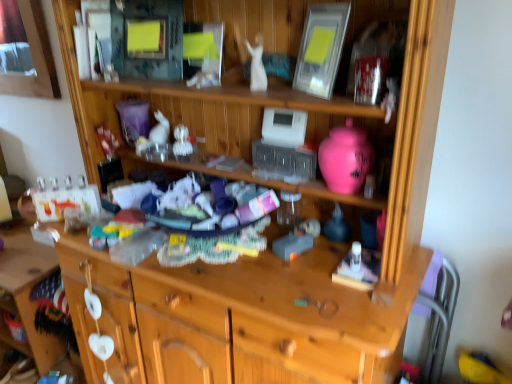
Question: Considering the relative positions of white glossy statue at center, acting as the second toy starting from the right, and pink glossy vase at upper right, the 1th toy in the front-to-back sequence, in the image provided, is white glossy statue at center, acting as the second toy starting from the right, to the right of pink glossy vase at upper right, the 1th toy in the front-to-back sequence, from the viewer's perspective?

Choices:
 (A) yes
 (B) no

Answer: (B)

Question: Considering the relative sizes of white glossy statue at center, the 3th toy positioned from the back, and pink glossy vase at upper right, the 1th toy when ordered from right to left, in the image provided, is white glossy statue at center, the 3th toy positioned from the back, wider than pink glossy vase at upper right, the 1th toy when ordered from right to left,?

Choices:
 (A) yes
 (B) no

Answer: (B)

Question: Is white glossy statue at center, the 2th toy from the front, not close to pink glossy vase at upper right, the 1th toy in the front-to-back sequence?

Choices:
 (A) yes
 (B) no

Answer: (B)

Question: Is white glossy statue at center, the 3th toy positioned from the back, taller than pink glossy vase at upper right, the 1th toy in the front-to-back sequence?

Choices:
 (A) no
 (B) yes

Answer: (A)

Question: Considering the relative positions of white glossy statue at center, the 3th toy positioned from the back, and pink glossy vase at upper right, the 1th toy when ordered from right to left, in the image provided, is white glossy statue at center, the 3th toy positioned from the back, to the left of pink glossy vase at upper right, the 1th toy when ordered from right to left, from the viewer's perspective?

Choices:
 (A) no
 (B) yes

Answer: (B)

Question: From the image's perspective, is white glossy statue at center, arranged as the 3th toy when viewed from the left, located beneath pink glossy vase at upper right, the 1th toy when ordered from right to left?

Choices:
 (A) no
 (B) yes

Answer: (A)

Question: From a real-world perspective, does clear plastic ornaments at center, arranged as the second toy when viewed from the left, stand above pink glossy vase at upper right, which is counted as the fourth toy, starting from the left?

Choices:
 (A) no
 (B) yes

Answer: (A)

Question: Considering the relative positions of clear plastic ornaments at center, arranged as the second toy when viewed from the left, and pink glossy vase at upper right, which is the fourth toy in back-to-front order, in the image provided, is clear plastic ornaments at center, arranged as the second toy when viewed from the left, in front of pink glossy vase at upper right, which is the fourth toy in back-to-front order,?

Choices:
 (A) yes
 (B) no

Answer: (B)

Question: Considering the relative sizes of clear plastic ornaments at center, arranged as the second toy when viewed from the left, and pink glossy vase at upper right, the 1th toy when ordered from right to left, in the image provided, is clear plastic ornaments at center, arranged as the second toy when viewed from the left, smaller than pink glossy vase at upper right, the 1th toy when ordered from right to left,?

Choices:
 (A) yes
 (B) no

Answer: (A)

Question: Does clear plastic ornaments at center, the third toy viewed from the front, have a greater height compared to pink glossy vase at upper right, which is counted as the fourth toy, starting from the left?

Choices:
 (A) no
 (B) yes

Answer: (A)

Question: Is clear plastic ornaments at center, which is the third toy from right to left, further to the viewer compared to pink glossy vase at upper right, the 1th toy when ordered from right to left?

Choices:
 (A) no
 (B) yes

Answer: (B)

Question: Is clear plastic ornaments at center, the second toy when ordered from back to front, at the left side of pink glossy vase at upper right, which is counted as the fourth toy, starting from the left?

Choices:
 (A) yes
 (B) no

Answer: (A)

Question: From a real-world perspective, is pink glossy vase at upper right, which is counted as the fourth toy, starting from the left, on matte silver picture frame at upper center?

Choices:
 (A) no
 (B) yes

Answer: (A)